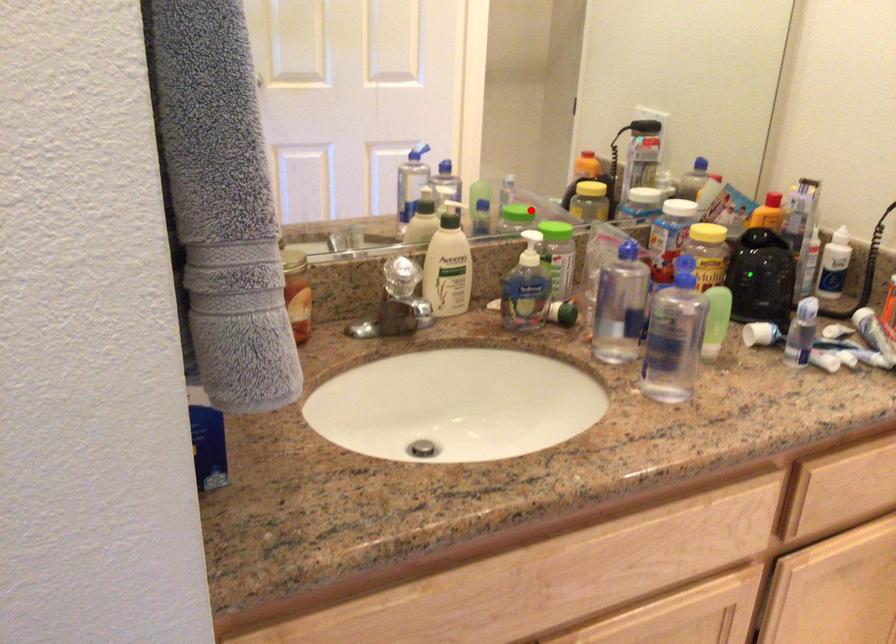
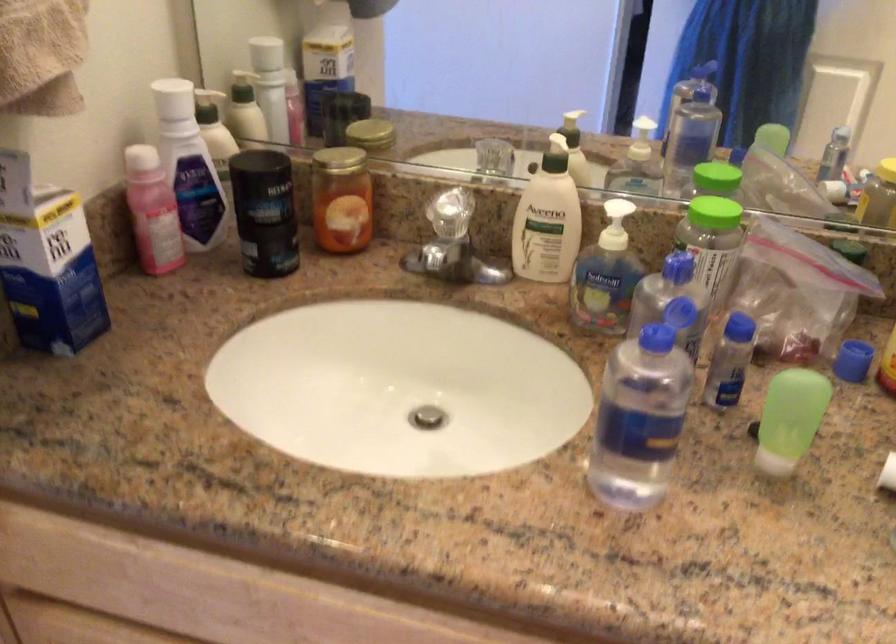
The point at the highlighted location is marked in the first image. Where is the corresponding point in the second image?

(716, 178)